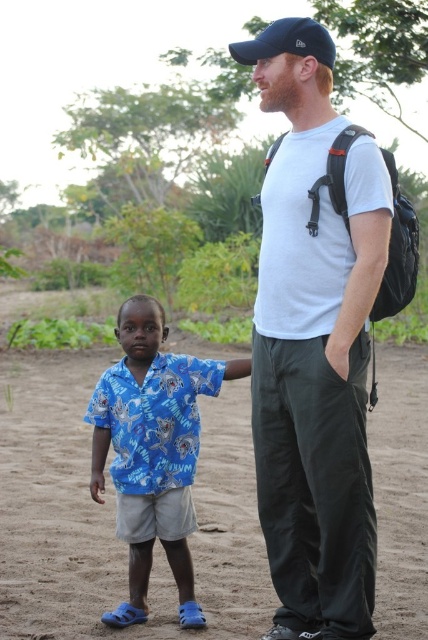
Between white matte t-shirt at center and navy blue fabric baseball cap at upper center, which one has more height?

Standing taller between the two is navy blue fabric baseball cap at upper center.

Can you confirm if white matte t-shirt at center is shorter than navy blue fabric baseball cap at upper center?

Correct, white matte t-shirt at center is not as tall as navy blue fabric baseball cap at upper center.

Which is behind, point (270, 234) or point (284, 26)?

The point (270, 234) is more distant.

The width and height of the screenshot is (428, 640). I want to click on white matte t-shirt at center, so click(314, 346).

Can you confirm if white matte t-shirt at center is positioned below blue printed shirt at center?

Actually, white matte t-shirt at center is above blue printed shirt at center.

Between point (259, 522) and point (198, 429), which one is positioned behind?

The point (198, 429) is behind.

At what (x,y) coordinates should I click in order to perform the action: click on white matte t-shirt at center. Please return your answer as a coordinate pair (x, y). The image size is (428, 640). Looking at the image, I should click on (314, 346).

Looking at this image, is brown sandy dirt at lower left bigger than blue printed shirt at center?

Yes, brown sandy dirt at lower left is bigger than blue printed shirt at center.

Which is below, brown sandy dirt at lower left or blue printed shirt at center?

brown sandy dirt at lower left

Image resolution: width=428 pixels, height=640 pixels. What are the coordinates of `brown sandy dirt at lower left` in the screenshot? It's located at (115, 513).